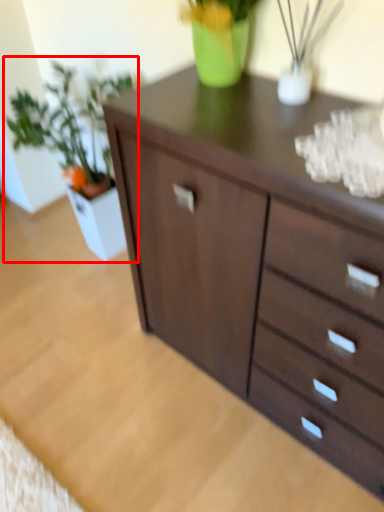
Question: From the image's perspective, considering the relative positions of houseplant (annotated by the red box) and chest of drawers in the image provided, where is houseplant (annotated by the red box) located with respect to the staircase?

Choices:
 (A) below
 (B) above

Answer: (B)